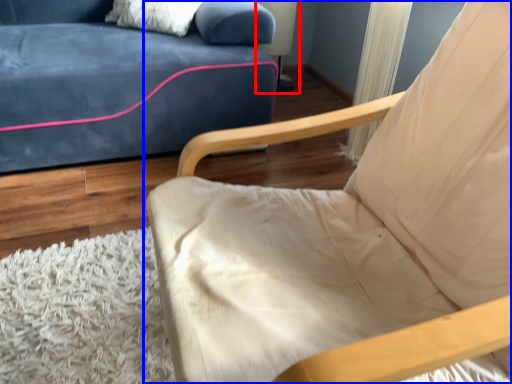
Question: Which point is further to the camera, table lamp (highlighted by a red box) or chair (highlighted by a blue box)?

Choices:
 (A) table lamp
 (B) chair

Answer: (A)